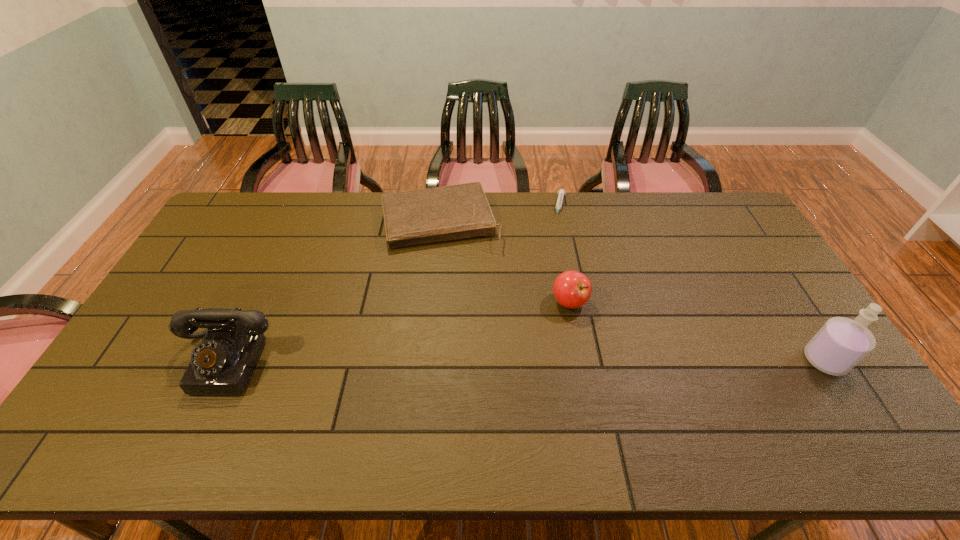
Find the location of a particular element. free space that is in between the perfume and the fourth shortest object is located at coordinates (525, 361).

Where is `free space between the rightmost object and the third shortest object`? free space between the rightmost object and the third shortest object is located at coordinates (697, 331).

In order to click on empty space between the syringe and the telephone in this screenshot , I will do `click(394, 284)`.

In order to click on free space between the second tallest object and the perfume in this screenshot , I will do `click(525, 361)`.

Image resolution: width=960 pixels, height=540 pixels. I want to click on vacant space in between the third tallest object and the fourth tallest object, so click(x=505, y=262).

What are the coordinates of `empty space between the apple and the syringe` in the screenshot? It's located at 565,254.

At what (x,y) coordinates should I click in order to perform the action: click on vacant space that is in between the syringe and the fourth tallest object. Please return your answer as a coordinate pair (x, y). This screenshot has height=540, width=960. Looking at the image, I should click on (500, 214).

Where is `free space between the syringe and the leftmost object`? The width and height of the screenshot is (960, 540). free space between the syringe and the leftmost object is located at coordinates (394, 284).

Identify the location of free spot between the rightmost object and the apple. The image size is (960, 540). (697, 331).

I want to click on object that is the nearest to the paperback book, so click(561, 192).